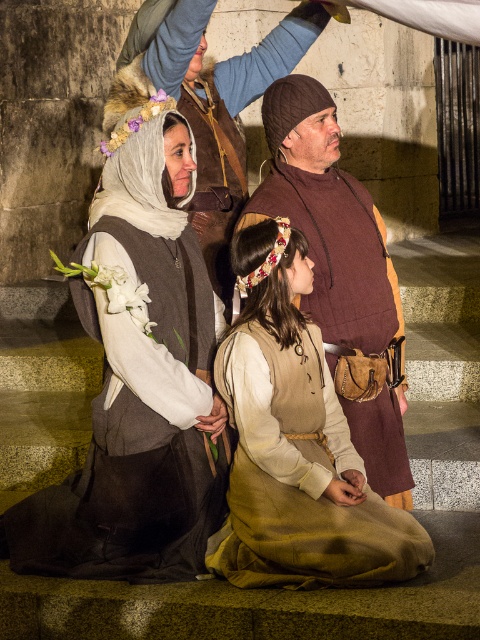
Question: Which object is the closest to the brown leather dress at center?

Choices:
 (A) brown leather vest at center
 (B) matte gray vest at center
 (C) fluffy fur headband at upper left
 (D) brown knitted vest at center

Answer: (B)

Question: Which point is farther to the camera?

Choices:
 (A) brown leather vest at center
 (B) matte gray vest at center
 (C) fluffy fur headband at upper left
 (D) brown knitted vest at center

Answer: (A)

Question: Is brown knitted vest at center to the left of fluffy fur headdress at upper left from the viewer's perspective?

Choices:
 (A) no
 (B) yes

Answer: (A)

Question: Does brown leather dress at center lie behind fluffy fur headdress at upper left?

Choices:
 (A) no
 (B) yes

Answer: (A)

Question: Can you confirm if brown leather dress at center is wider than brown knitted vest at center?

Choices:
 (A) no
 (B) yes

Answer: (B)

Question: Which point is farther to the camera?

Choices:
 (A) (126, 312)
 (B) (311, 504)
 (C) (144, 204)

Answer: (C)